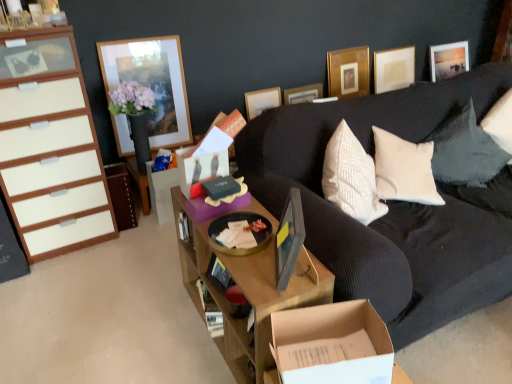
Question: Is wooden picture frame at upper left, marked as the first picture frame in a left-to-right arrangement, oriented away from black textured pillow at upper right?

Choices:
 (A) no
 (B) yes

Answer: (A)

Question: Is wooden picture frame at upper left, acting as the 6th picture frame starting from the right, not within black textured pillow at upper right?

Choices:
 (A) yes
 (B) no

Answer: (A)

Question: Can you confirm if wooden picture frame at upper left, the fifth picture frame viewed from the back, is shorter than black textured pillow at upper right?

Choices:
 (A) yes
 (B) no

Answer: (B)

Question: Could you tell me if wooden picture frame at upper left, marked as the first picture frame in a left-to-right arrangement, is facing black textured pillow at upper right?

Choices:
 (A) yes
 (B) no

Answer: (B)

Question: From a real-world perspective, is wooden picture frame at upper left, marked as the first picture frame in a left-to-right arrangement, under black textured pillow at upper right?

Choices:
 (A) no
 (B) yes

Answer: (A)

Question: Choose the correct answer: Is white glossy cabinet at left, acting as the second cabinetry starting from the right, inside matte wooden picture frame at upper right, arranged as the sixth picture frame when viewed from the left, or outside it?

Choices:
 (A) outside
 (B) inside

Answer: (A)

Question: Considering the positions of white glossy cabinet at left, the 1th cabinetry when ordered from left to right, and matte wooden picture frame at upper right, arranged as the sixth picture frame when viewed from the left, in the image, is white glossy cabinet at left, the 1th cabinetry when ordered from left to right, bigger or smaller than matte wooden picture frame at upper right, arranged as the sixth picture frame when viewed from the left,?

Choices:
 (A) big
 (B) small

Answer: (A)

Question: Would you say white glossy cabinet at left, acting as the second cabinetry starting from the right, is to the left or to the right of matte wooden picture frame at upper right, the 6th picture frame when ordered from front to back, in the picture?

Choices:
 (A) right
 (B) left

Answer: (B)

Question: Does point (23, 92) appear closer or farther from the camera than point (437, 56)?

Choices:
 (A) closer
 (B) farther

Answer: (A)

Question: In terms of size, does cardboard box at lower center appear bigger or smaller than matte wooden picture frame at upper right, arranged as the sixth picture frame when viewed from the left?

Choices:
 (A) small
 (B) big

Answer: (A)

Question: From the image's perspective, is cardboard box at lower center positioned above or below matte wooden picture frame at upper right, arranged as the sixth picture frame when viewed from the left?

Choices:
 (A) below
 (B) above

Answer: (A)

Question: Is point (310, 354) closer or farther from the camera than point (466, 69)?

Choices:
 (A) farther
 (B) closer

Answer: (B)

Question: Considering their positions, is cardboard box at lower center located in front of or behind matte wooden picture frame at upper right, arranged as the sixth picture frame when viewed from the left?

Choices:
 (A) behind
 (B) front

Answer: (B)

Question: Is point (97, 163) positioned closer to the camera than point (259, 327)?

Choices:
 (A) closer
 (B) farther

Answer: (B)

Question: Based on their positions, is white glossy cabinet at left, the 1th cabinetry when ordered from left to right, located to the left or right of wooden desk at center?

Choices:
 (A) right
 (B) left

Answer: (B)